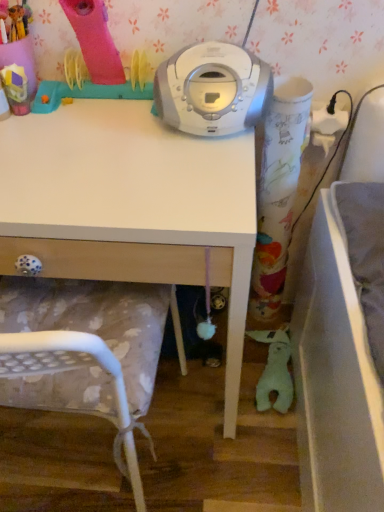
Question: Would you say green plush toy at lower right, arranged as the first toy when ordered from the bottom, is part of white plastic chair at lower left's contents?

Choices:
 (A) no
 (B) yes

Answer: (A)

Question: Is white plastic chair at lower left bigger than green plush toy at lower right, acting as the 2th toy starting from the front?

Choices:
 (A) no
 (B) yes

Answer: (B)

Question: Are white plastic chair at lower left and green plush toy at lower right, acting as the 2th toy starting from the front, located far from each other?

Choices:
 (A) no
 (B) yes

Answer: (A)

Question: From a real-world perspective, is white plastic chair at lower left positioned under green plush toy at lower right, which ranks as the 2th toy in top-to-bottom order, based on gravity?

Choices:
 (A) no
 (B) yes

Answer: (A)

Question: Considering the relative positions of white plastic chair at lower left and green plush toy at lower right, the 1th toy viewed from the back, in the image provided, is white plastic chair at lower left in front of green plush toy at lower right, the 1th toy viewed from the back,?

Choices:
 (A) no
 (B) yes

Answer: (B)

Question: Is point (288, 339) positioned closer to the camera than point (112, 339)?

Choices:
 (A) closer
 (B) farther

Answer: (B)

Question: Considering the relative positions of green plush toy at lower right, which ranks as the 2th toy in top-to-bottom order, and white plastic chair at lower left in the image provided, is green plush toy at lower right, which ranks as the 2th toy in top-to-bottom order, to the left or to the right of white plastic chair at lower left?

Choices:
 (A) left
 (B) right

Answer: (B)

Question: In terms of height, does green plush toy at lower right, which ranks as the 2th toy in top-to-bottom order, look taller or shorter compared to white plastic chair at lower left?

Choices:
 (A) short
 (B) tall

Answer: (A)

Question: In the image, is green plush toy at lower right, acting as the 2th toy starting from the front, positioned in front of or behind white plastic chair at lower left?

Choices:
 (A) behind
 (B) front

Answer: (A)

Question: Is white plastic chair at lower left taller or shorter than rubberized pink hairdryer at upper left, which is counted as the 1th toy, starting from the front?

Choices:
 (A) tall
 (B) short

Answer: (A)

Question: From a real-world perspective, is white plastic chair at lower left positioned above or below rubberized pink hairdryer at upper left, which is counted as the 1th toy, starting from the front?

Choices:
 (A) above
 (B) below

Answer: (B)

Question: Does point (8, 305) appear closer or farther from the camera than point (1, 73)?

Choices:
 (A) closer
 (B) farther

Answer: (B)

Question: Is white plastic chair at lower left situated inside rubberized pink hairdryer at upper left, which is counted as the 1th toy, starting from the front, or outside?

Choices:
 (A) outside
 (B) inside

Answer: (A)

Question: From a real-world perspective, is white matte desk at center above or below rubberized pink hairdryer at upper left, marked as the second toy in a back-to-front arrangement?

Choices:
 (A) above
 (B) below

Answer: (B)

Question: Considering the positions of white matte desk at center and rubberized pink hairdryer at upper left, arranged as the 1th toy when viewed from the left, in the image, is white matte desk at center taller or shorter than rubberized pink hairdryer at upper left, arranged as the 1th toy when viewed from the left,?

Choices:
 (A) tall
 (B) short

Answer: (A)